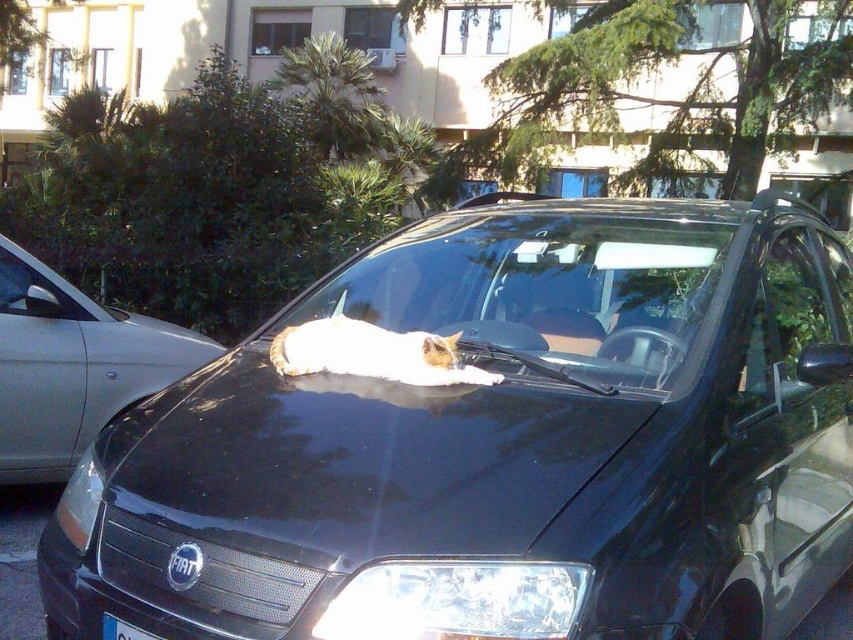
Where is `black glossy car at center`? The height and width of the screenshot is (640, 853). black glossy car at center is located at coordinates (498, 445).

The width and height of the screenshot is (853, 640). What do you see at coordinates (498, 445) in the screenshot? I see `black glossy car at center` at bounding box center [498, 445].

Locate an element on the screen. The height and width of the screenshot is (640, 853). black glossy car at center is located at coordinates (498, 445).

Can you confirm if clear glass windshield at center is wider than silver metallic sedan at left?

Correct, the width of clear glass windshield at center exceeds that of silver metallic sedan at left.

Which is below, clear glass windshield at center or silver metallic sedan at left?

silver metallic sedan at left is lower down.

Who is more forward, (538, 230) or (57, 326)?

Positioned in front is point (538, 230).

At what (x,y) coordinates should I click in order to perform the action: click on clear glass windshield at center. Please return your answer as a coordinate pair (x, y). This screenshot has width=853, height=640. Looking at the image, I should click on (544, 289).

Which is behind, point (357, 625) or point (83, 316)?

Point (83, 316)

Locate an element on the screen. The width and height of the screenshot is (853, 640). black glossy car at center is located at coordinates (498, 445).

The height and width of the screenshot is (640, 853). What are the coordinates of `black glossy car at center` in the screenshot? It's located at (498, 445).